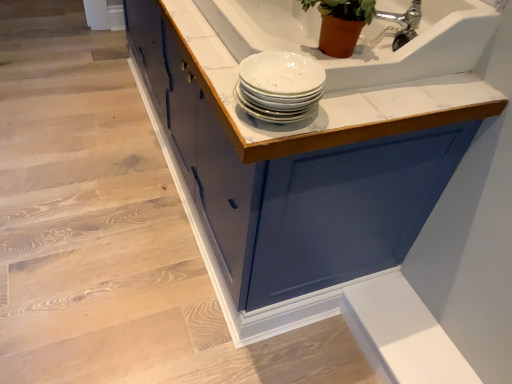
Where is `free location to the right of white glossy plates at upper center`? This screenshot has height=384, width=512. free location to the right of white glossy plates at upper center is located at coordinates (367, 106).